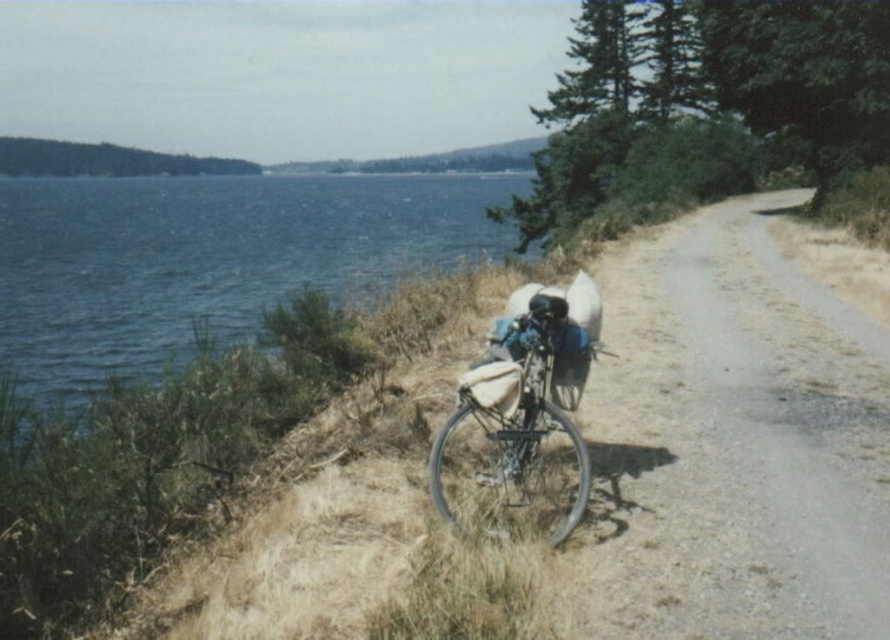
You are standing on the gravel path and want to walk to the metallic silver bicycle at center. Which direction should you move to avoid stepping into the blue water at left?

The blue water at left is located above the metallic silver bicycle at center, so you should move downward towards the bicycle to avoid stepping into the water.

You are standing at the point marked as point (735, 444). What is the surface you are currently standing on?

The point (735, 444) is on gravel road at center, so you are standing on the gravel road.